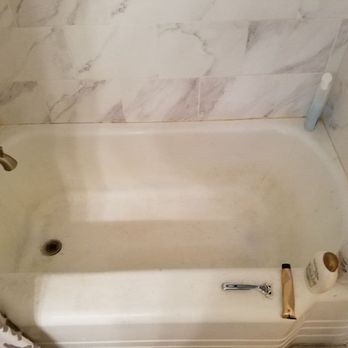
Locate an element on the screen. The width and height of the screenshot is (348, 348). curtains is located at coordinates (4, 338).